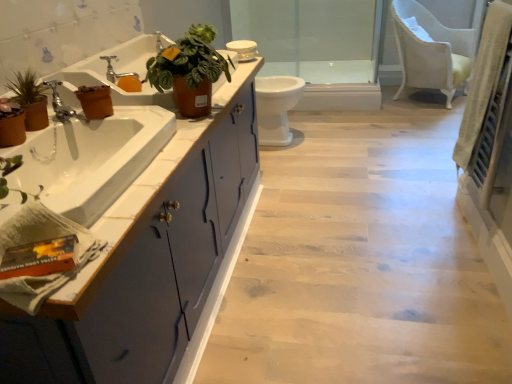
Locate an element on the screen. This screenshot has width=512, height=384. vacant space in front of white fabric chair at upper right is located at coordinates (419, 119).